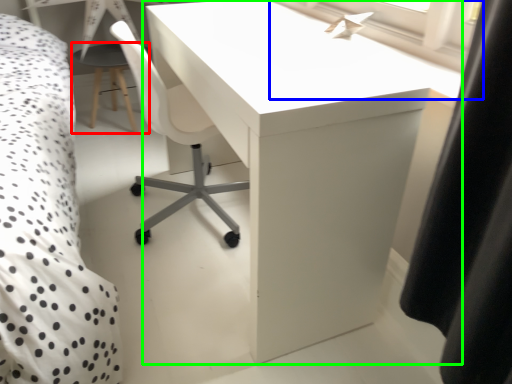
Question: Which object is positioned closest to side table (highlighted by a red box)? Select from window screen (highlighted by a blue box) and table (highlighted by a green box).

Choices:
 (A) window screen
 (B) table

Answer: (B)